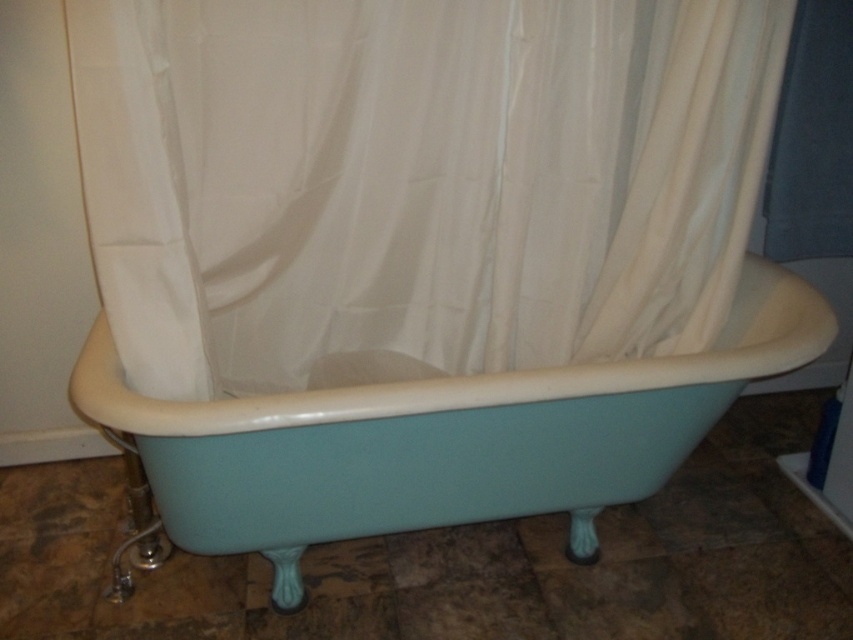
Question: Which point appears farthest from the camera in this image?

Choices:
 (A) (695, 406)
 (B) (346, 93)

Answer: (B)

Question: Can you confirm if white fabric shower curtain at center is bigger than teal glossy bathtub at center?

Choices:
 (A) no
 (B) yes

Answer: (A)

Question: Can you confirm if white fabric shower curtain at center is thinner than teal glossy bathtub at center?

Choices:
 (A) yes
 (B) no

Answer: (A)

Question: Does white fabric shower curtain at center appear under teal glossy bathtub at center?

Choices:
 (A) yes
 (B) no

Answer: (B)

Question: Which of the following is the farthest from the observer?

Choices:
 (A) white fabric shower curtain at center
 (B) teal glossy bathtub at center

Answer: (A)